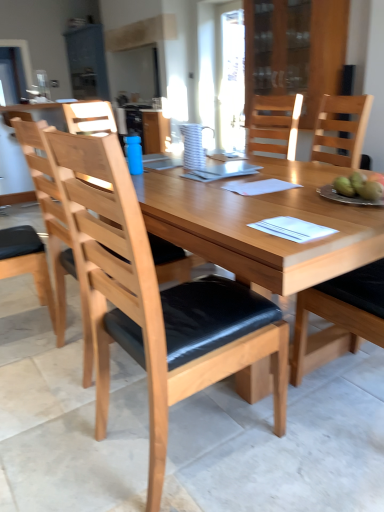
Question: From a real-world perspective, relative to natural wood chair at right, positioned as the first chair in right-to-left order, is light wood/black cushion chair at center, the 2th chair viewed from the left, vertically above or below?

Choices:
 (A) below
 (B) above

Answer: (B)

Question: Is light wood/black cushion chair at center, the 2th chair viewed from the left, wider or thinner than natural wood chair at right, positioned as the first chair in right-to-left order?

Choices:
 (A) wide
 (B) thin

Answer: (A)

Question: Estimate the real-world distances between objects in this image. Which object is closer to the natural wood chair at right, positioned as the first chair in right-to-left order?

Choices:
 (A) blue matte bottle at center
 (B) green matte apples at right
 (C) transparent glass cabinet at upper center
 (D) light brown wood chair at center, the third chair from the right
 (E) light wood/black cushion chair at center, the 2th chair viewed from the left

Answer: (B)

Question: Which is farther from the white striped pitcher at center?

Choices:
 (A) natural wood chair at right, which is the third chair from left to right
 (B) green matte apples at right
 (C) light brown wood chair at center, positioned as the 1th chair in left-to-right order
 (D) metallic silver plate at right
 (E) transparent glass cabinet at upper center

Answer: (E)